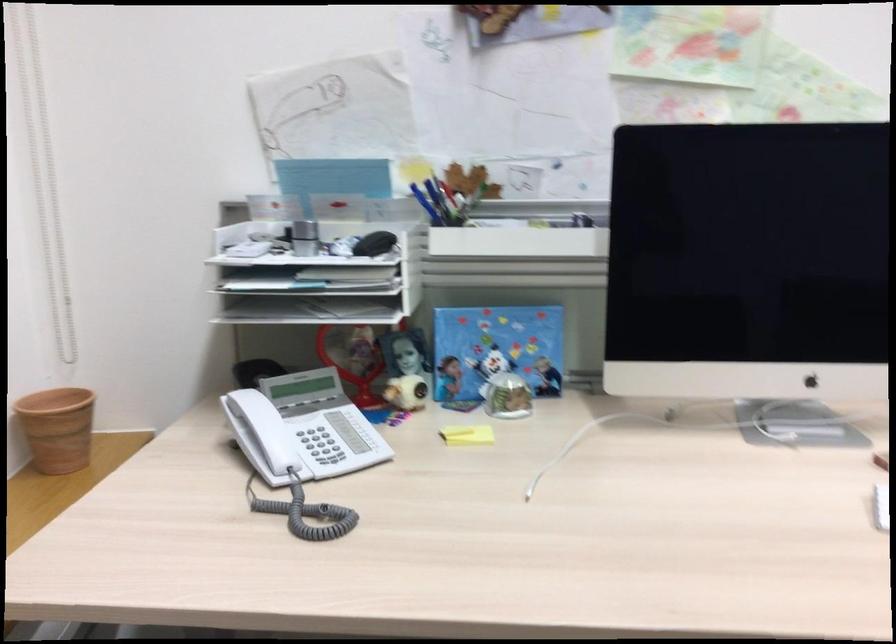
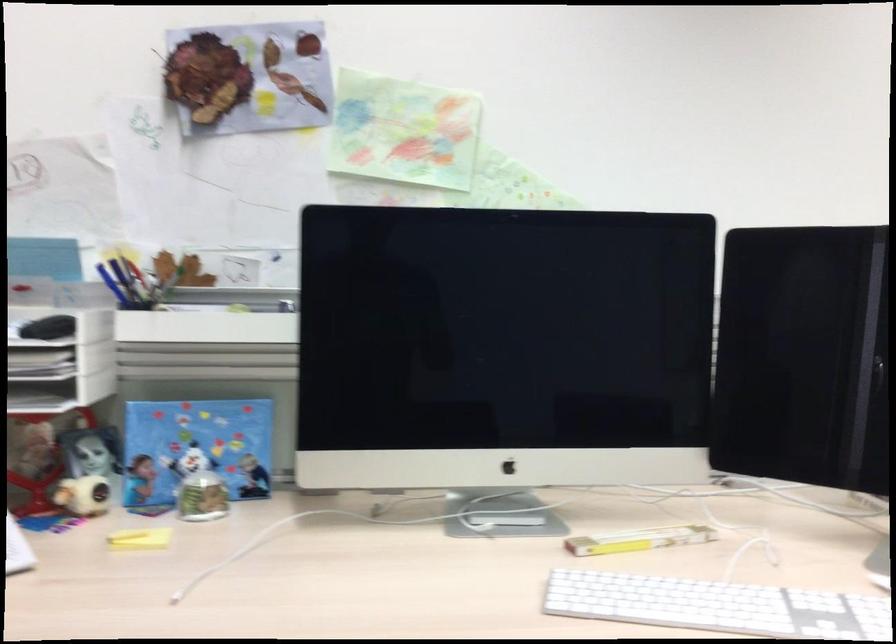
In the second image, find the point that corresponds to (x=737, y=399) in the first image.

(449, 494)